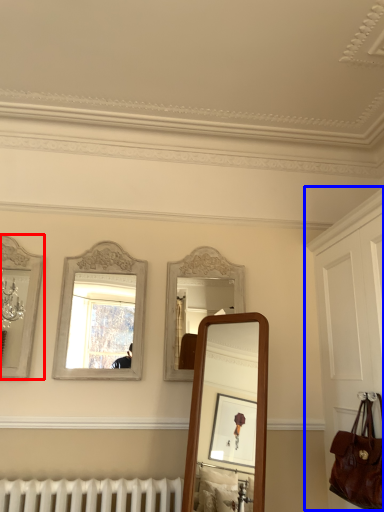
Question: Which object is closer to the camera taking this photo, mirror (highlighted by a red box) or dresser (highlighted by a blue box)?

Choices:
 (A) mirror
 (B) dresser

Answer: (B)